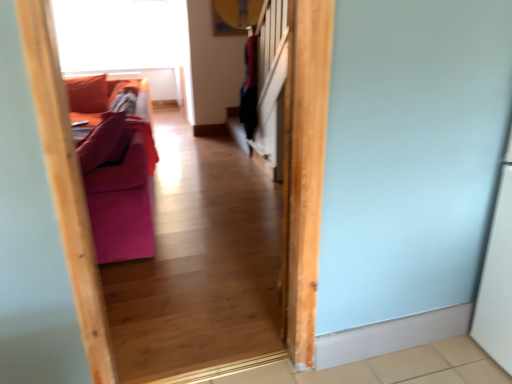
The image size is (512, 384). What are the coordinates of `vacant space to the right of matte purple couch at left` in the screenshot? It's located at (208, 233).